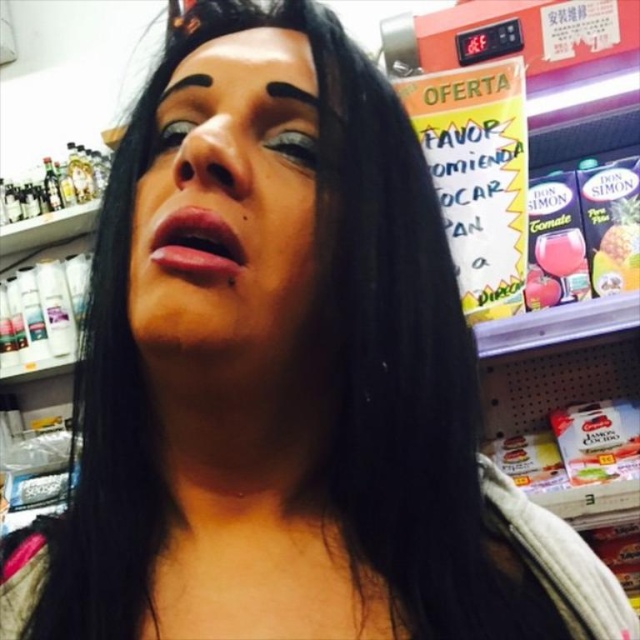
Question: Is matte black eye at upper center closer to the viewer compared to black matte eyebrow at upper left?

Choices:
 (A) no
 (B) yes

Answer: (B)

Question: Does black matte forehead at upper center have a lesser width compared to black matte eyebrow at upper center?

Choices:
 (A) no
 (B) yes

Answer: (A)

Question: Which point is farther to the camera?

Choices:
 (A) black matte eyebrow at upper center
 (B) matte black eye at upper center
 (C) smooth skin face at center
 (D) black matte eyebrow at upper left

Answer: (D)

Question: Estimate the real-world distances between objects in this image. Which object is closer to the matte black eye at center?

Choices:
 (A) matte black eye at upper center
 (B) black matte eyebrow at upper left
 (C) black matte eyebrow at upper center
 (D) black matte forehead at upper center

Answer: (B)

Question: Can you confirm if matte black eye at upper center is positioned above matte black eye at center?

Choices:
 (A) no
 (B) yes

Answer: (A)

Question: Which of the following is the farthest from the observer?

Choices:
 (A) (196, 84)
 (B) (180, 84)

Answer: (B)